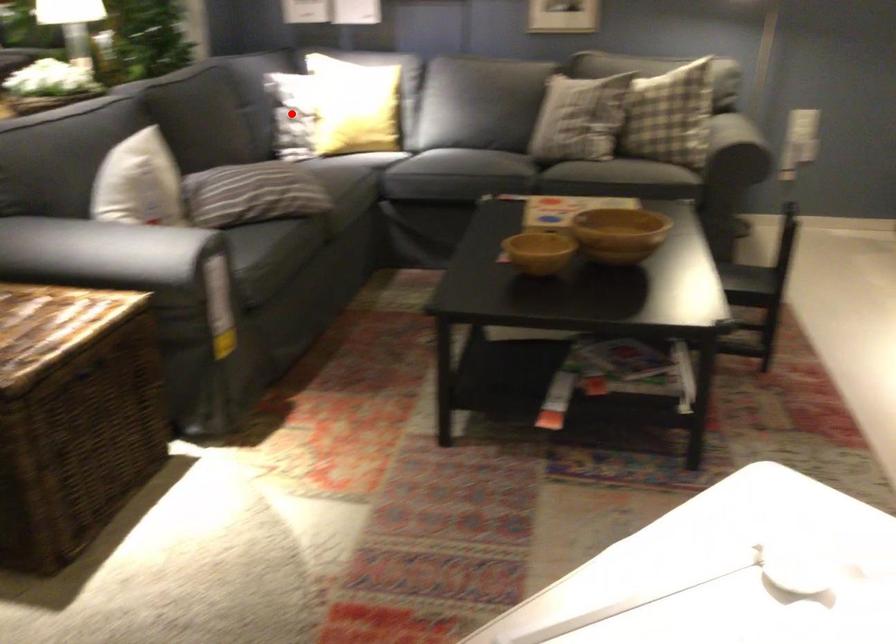
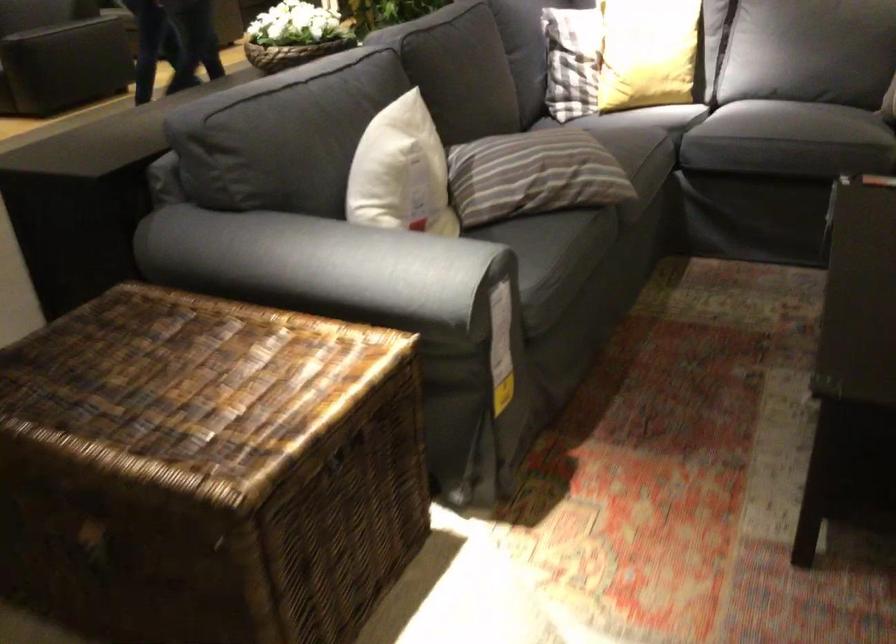
Question: I am providing you with two images of the same scene from different viewpoints. A red point is shown in image1. For the corresponding object point in image2, is it positioned nearer or farther from the camera?

Choices:
 (A) Nearer
 (B) Farther

Answer: (A)